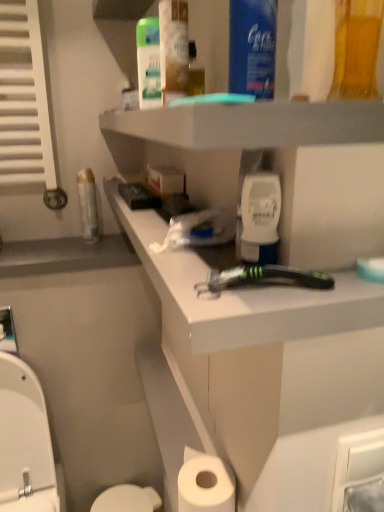
Question: Is black plastic razor at center oriented towards white plastic toilet seat at lower left?

Choices:
 (A) no
 (B) yes

Answer: (A)

Question: Is black plastic razor at center positioned behind white plastic toilet seat at lower left?

Choices:
 (A) no
 (B) yes

Answer: (A)

Question: Can you confirm if black plastic razor at center is wider than white plastic toilet seat at lower left?

Choices:
 (A) yes
 (B) no

Answer: (B)

Question: Considering the relative sizes of black plastic razor at center and white plastic toilet seat at lower left in the image provided, is black plastic razor at center thinner than white plastic toilet seat at lower left?

Choices:
 (A) no
 (B) yes

Answer: (B)

Question: Would you say black plastic razor at center is a long distance from white plastic toilet seat at lower left?

Choices:
 (A) yes
 (B) no

Answer: (A)

Question: Does black plastic razor at center appear on the right side of white plastic toilet seat at lower left?

Choices:
 (A) no
 (B) yes

Answer: (B)

Question: Is white glossy toilet bowl at lower left positioned in front of blue plastic mouthwash at upper center, positioned as the third mouthwash in left-to-right order?

Choices:
 (A) no
 (B) yes

Answer: (A)

Question: Is white glossy toilet bowl at lower left thinner than blue plastic mouthwash at upper center, placed as the second mouthwash when sorted from front to back?

Choices:
 (A) no
 (B) yes

Answer: (A)

Question: Does white glossy toilet bowl at lower left have a smaller size compared to blue plastic mouthwash at upper center, which is counted as the third mouthwash, starting from the right?

Choices:
 (A) yes
 (B) no

Answer: (B)

Question: Is white glossy toilet bowl at lower left with blue plastic mouthwash at upper center, which is counted as the third mouthwash, starting from the right?

Choices:
 (A) no
 (B) yes

Answer: (A)

Question: Does white glossy toilet bowl at lower left have a lesser height compared to blue plastic mouthwash at upper center, which is counted as the third mouthwash, starting from the right?

Choices:
 (A) yes
 (B) no

Answer: (A)

Question: From the image's perspective, does white glossy toilet bowl at lower left appear higher than blue plastic mouthwash at upper center, placed as the second mouthwash when sorted from front to back?

Choices:
 (A) no
 (B) yes

Answer: (A)

Question: Considering the relative sizes of white matte toilet paper at lower center and white plastic razor at center in the image provided, is white matte toilet paper at lower center taller than white plastic razor at center?

Choices:
 (A) no
 (B) yes

Answer: (B)